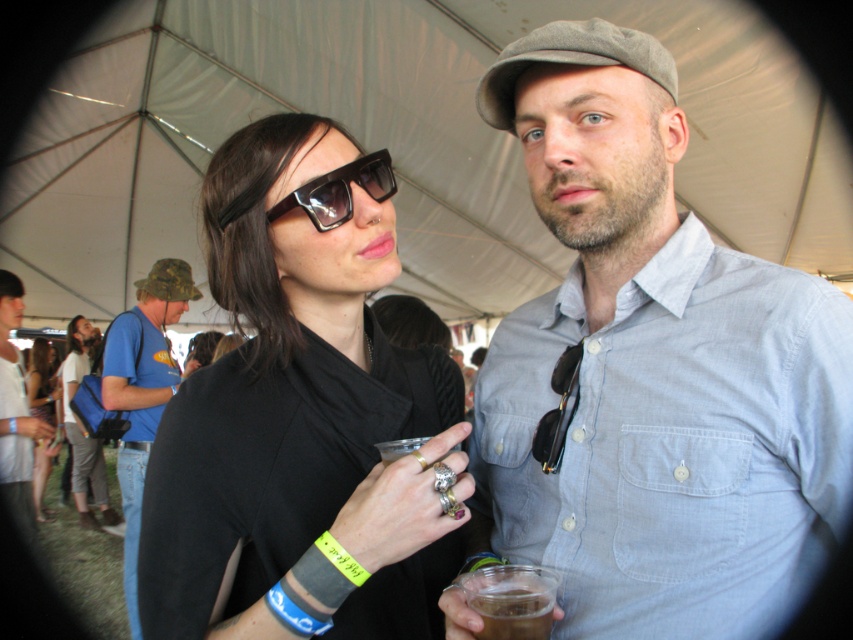
From the picture: Does black matte sunglasses at upper center have a larger size compared to blue fabric wristband at lower left?

Correct, black matte sunglasses at upper center is larger in size than blue fabric wristband at lower left.

Can you confirm if black matte sunglasses at upper center is positioned to the right of blue fabric wristband at lower left?

Indeed, black matte sunglasses at upper center is positioned on the right side of blue fabric wristband at lower left.

Locate an element on the screen. The width and height of the screenshot is (853, 640). black matte sunglasses at upper center is located at coordinates (558, 410).

Which is more to the right, camouflage fabric hat at left or black matte sunglasses at upper center?

Positioned to the right is black matte sunglasses at upper center.

Who is more distant from viewer, (161,321) or (566,348)?

The point (161,321) is behind.

I want to click on camouflage fabric hat at left, so click(142, 390).

Does black matte sunglasses at upper center appear on the right side of neon green fabric wristband at lower center?

Yes, black matte sunglasses at upper center is to the right of neon green fabric wristband at lower center.

Is black matte sunglasses at upper center positioned before neon green fabric wristband at lower center?

Yes, black matte sunglasses at upper center is closer to the viewer.

At what (x,y) coordinates should I click in order to perform the action: click on black matte sunglasses at upper center. Please return your answer as a coordinate pair (x, y). The width and height of the screenshot is (853, 640). Looking at the image, I should click on (558, 410).

Locate an element on the screen. This screenshot has width=853, height=640. black matte sunglasses at upper center is located at coordinates (558, 410).